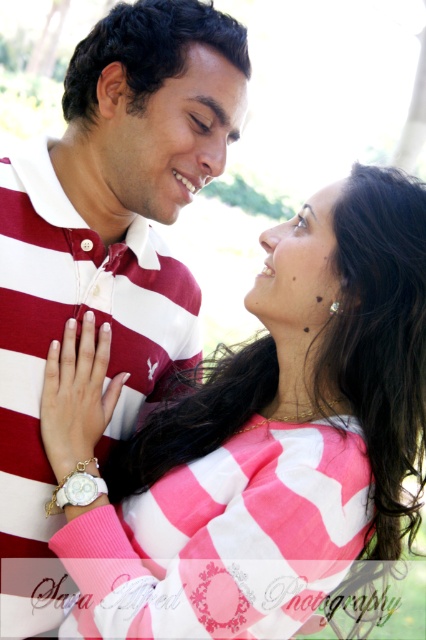
Question: Is pink striped sweater at center closer to camera compared to maroon striped polo shirt at center?

Choices:
 (A) yes
 (B) no

Answer: (A)

Question: Which point is closer to the camera?

Choices:
 (A) pink striped sweater at center
 (B) maroon striped polo shirt at center

Answer: (A)

Question: Is pink striped sweater at center to the right of maroon striped polo shirt at center from the viewer's perspective?

Choices:
 (A) yes
 (B) no

Answer: (A)

Question: Does pink striped sweater at center lie behind maroon striped polo shirt at center?

Choices:
 (A) yes
 (B) no

Answer: (B)

Question: Among these objects, which one is nearest to the camera?

Choices:
 (A) maroon striped polo shirt at center
 (B) pink striped sweater at center

Answer: (B)